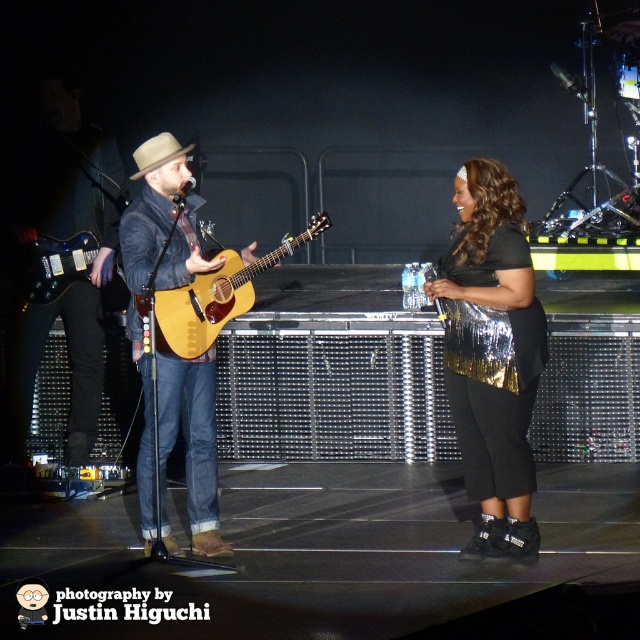
You are a photographer taking a picture of the black sequined purse at center and the beige felt cowboy hat at center. Which object should you focus on first if you want to capture both clearly in the same frame?

The black sequined purse at center is closer to the viewer than the beige felt cowboy hat at center, so you should focus on the black sequined purse at center first to ensure both are in focus.

You are a photographer at the concert. You want to take a photo of the black sequined purse at center. Where should you aim your camera to capture it?

The black sequined purse at center is located at the coordinates point (492, 355), so you should aim your camera at that point to capture it.